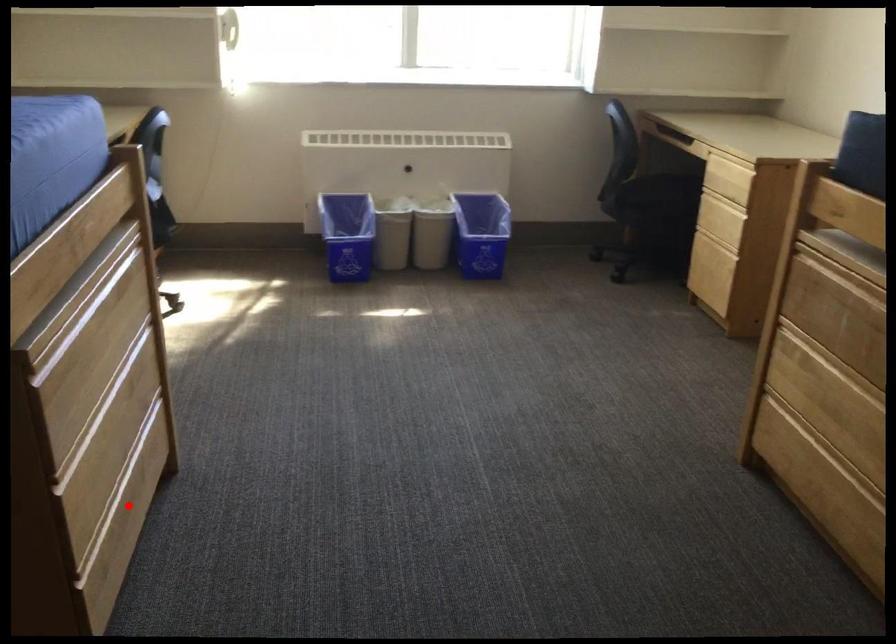
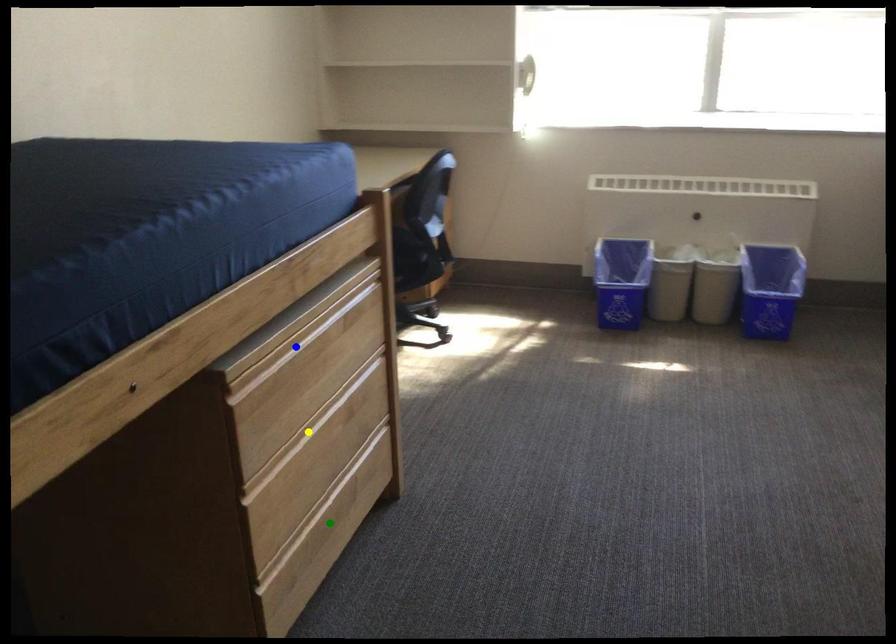
Question: I am providing you with two images of the same scene from different viewpoints. A red point is marked on the first image. You are given multiple points on the second image. Which point in image 2 is actually the same real-world point as the red point in image 1?

Choices:
 (A) green point
 (B) yellow point
 (C) blue point

Answer: (A)